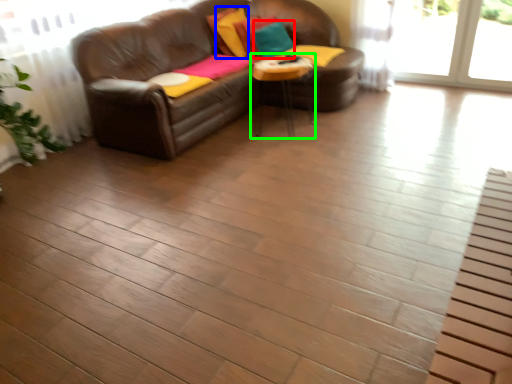
Question: Which object is positioned farthest from pillow (highlighted by a red box)? Select from pillow (highlighted by a blue box) and table (highlighted by a green box).

Choices:
 (A) pillow
 (B) table

Answer: (B)